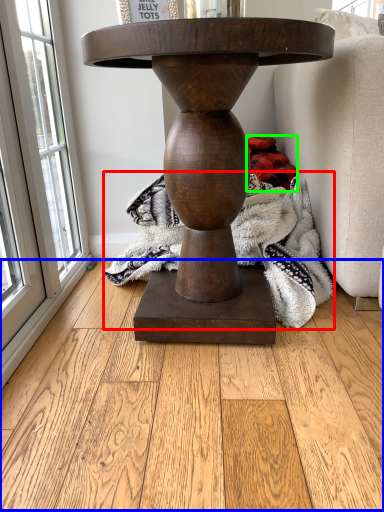
Question: Which is farther away from blanket (highlighted by a red box)? hardwood (highlighted by a blue box) or material (highlighted by a green box)?

Choices:
 (A) hardwood
 (B) material

Answer: (A)